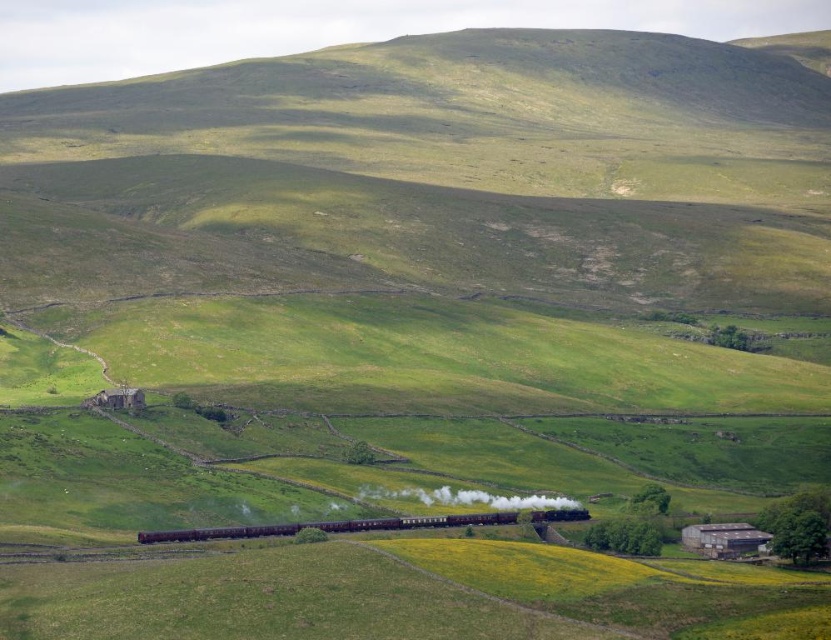
Is polished dark brown train at center wider than polished dark brown steam at center?

Yes.

Who is lower down, polished dark brown train at center or polished dark brown steam at center?

polished dark brown train at center is below.

Between point (485, 513) and point (453, 492), which one is positioned in front?

Point (485, 513)

Where is `polished dark brown train at center`? This screenshot has height=640, width=831. polished dark brown train at center is located at coordinates (365, 524).